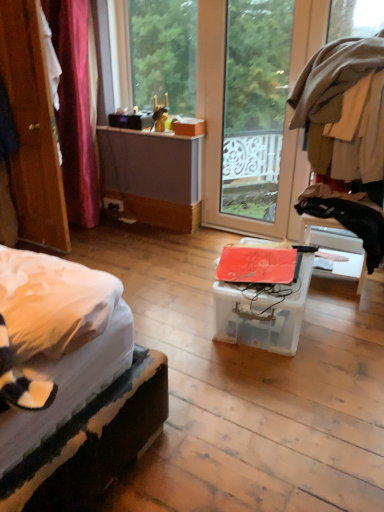
Measure the distance between transparent glass window at upper center and camera.

transparent glass window at upper center is 3.25 meters away from camera.

Describe the element at coordinates (113, 204) in the screenshot. This screenshot has height=512, width=384. I see `black plastic power outlet at lower left` at that location.

Find the location of a particular element. black fabric at right is located at coordinates (350, 213).

The height and width of the screenshot is (512, 384). Identify the location of wooden door at left. (32, 128).

Find the location of a particular element. transparent plastic box at center is located at coordinates (262, 295).

Measure the distance between transparent glass door at center and camera.

The distance of transparent glass door at center from camera is 13.15 feet.

The image size is (384, 512). I want to click on transparent glass window at upper center, so click(157, 53).

From a real-world perspective, is black plastic power outlet at lower left positioned under black fabric at right based on gravity?

Yes, from a real-world perspective, black plastic power outlet at lower left is below black fabric at right.

You are a GUI agent. You are given a task and a screenshot of the screen. Output one action in this format:
    pyautogui.click(x=<x>, y=<y>)
    Task: Click on the clothing lying in front of the black plastic power outlet at lower left
    Image resolution: width=384 pixels, height=512 pixels.
    Given the screenshot: What is the action you would take?
    pyautogui.click(x=350, y=213)

Would you say black plastic power outlet at lower left is outside black fabric at right?

Absolutely, black plastic power outlet at lower left is external to black fabric at right.

From their relative heights in the image, would you say black plastic power outlet at lower left is taller or shorter than black fabric at right?

Considering their sizes, black plastic power outlet at lower left has less height than black fabric at right.

Measure the distance from wooden door at left to transparent glass window at upper center.

They are 1.31 meters apart.

Would you say wooden door at left is inside or outside transparent glass window at upper center?

wooden door at left is outside transparent glass window at upper center.

Between wooden door at left and transparent glass window at upper center, which one appears on the right side from the viewer's perspective?

Positioned to the right is transparent glass window at upper center.

Considering the sizes of objects wooden door at left and transparent glass window at upper center in the image provided, who is smaller, wooden door at left or transparent glass window at upper center?

Smaller between the two is transparent glass window at upper center.

Is black fabric at right touching black plastic power outlet at lower left?

No, black fabric at right is not making contact with black plastic power outlet at lower left.

Would you say black fabric at right is outside black plastic power outlet at lower left?

black fabric at right lies outside black plastic power outlet at lower left's area.

Is black fabric at right oriented towards black plastic power outlet at lower left?

No.

Is black fabric at right smaller than black plastic power outlet at lower left?

Incorrect, black fabric at right is not smaller in size than black plastic power outlet at lower left.

Is transparent glass door at center positioned far away from wooden door at left?

Yes, transparent glass door at center and wooden door at left are quite far apart.

From a real-world perspective, is transparent glass door at center physically located above or below wooden door at left?

transparent glass door at center is situated lower than wooden door at left in the real world.

Is transparent glass door at center looking in the opposite direction of wooden door at left?

No.

Locate an element on the screen. The width and height of the screenshot is (384, 512). glass door on the right of the wooden door at left is located at coordinates (255, 105).

Can you see black plastic power outlet at lower left touching transparent glass window at upper center?

No, black plastic power outlet at lower left is not making contact with transparent glass window at upper center.

Could you tell me if black plastic power outlet at lower left is facing transparent glass window at upper center?

No, black plastic power outlet at lower left is not turned towards transparent glass window at upper center.

Is black plastic power outlet at lower left situated inside transparent glass window at upper center or outside?

black plastic power outlet at lower left is not inside transparent glass window at upper center, it's outside.

Looking at this image, is wooden door at left closer to the viewer compared to transparent plastic box at center?

No, wooden door at left is further to the viewer.

Is transparent plastic box at center completely or partially inside wooden door at left?

That's incorrect, transparent plastic box at center is not inside wooden door at left.

Considering the points (37, 97) and (275, 302), which point is in front, point (37, 97) or point (275, 302)?

Point (275, 302)

In the image, is transparent plastic box at center positioned in front of or behind transparent glass window at upper center?

transparent plastic box at center is positioned closer to the viewer than transparent glass window at upper center.

Identify the location of box on the right of transparent glass window at upper center. (262, 295).

Considering the sizes of transparent plastic box at center and transparent glass window at upper center in the image, is transparent plastic box at center wider or thinner than transparent glass window at upper center?

Clearly, transparent plastic box at center has more width compared to transparent glass window at upper center.

Is transparent plastic box at center inside or outside of transparent glass window at upper center?

transparent plastic box at center is located beyond the bounds of transparent glass window at upper center.

The image size is (384, 512). I want to click on clothing in front of the black plastic power outlet at lower left, so click(x=350, y=213).

The width and height of the screenshot is (384, 512). In order to click on window behind the wooden door at left in this screenshot , I will do `click(157, 53)`.

Looking at the image, which one is located further to transparent plastic box at center, transparent glass window at upper center or transparent glass door at center?

transparent glass door at center is further to transparent plastic box at center.

Based on their spatial positions, is transparent glass door at center or transparent plastic box at center closer to black plastic power outlet at lower left?

Among the two, transparent plastic box at center is located nearer to black plastic power outlet at lower left.

When comparing their distances from transparent plastic box at center, does transparent glass window at upper center or wooden door at left seem closer?

wooden door at left lies closer to transparent plastic box at center than the other object.

Looking at the image, which one is located closer to wooden door at left, black fabric at right or transparent plastic box at center?

transparent plastic box at center lies closer to wooden door at left than the other object.

Which object lies further to the anchor point transparent glass window at upper center, black plastic power outlet at lower left or wooden door at left?

black plastic power outlet at lower left.

Looking at the image, which one is located closer to wooden door at left, black plastic power outlet at lower left or black fabric at right?

The object closer to wooden door at left is black plastic power outlet at lower left.

Looking at the image, which one is located closer to black plastic power outlet at lower left, black fabric at right or transparent glass window at upper center?

transparent glass window at upper center is positioned closer to the anchor black plastic power outlet at lower left.

Which object lies further to the anchor point transparent plastic box at center, black fabric at right or transparent glass door at center?

Among the two, transparent glass door at center is located further to transparent plastic box at center.

I want to click on window located between transparent glass door at center and black plastic power outlet at lower left in the depth direction, so click(x=157, y=53).

The width and height of the screenshot is (384, 512). In order to click on power outlet between wooden door at left and black fabric at right in this screenshot , I will do `click(113, 204)`.

Locate an element on the screen. This screenshot has width=384, height=512. window between transparent plastic box at center and black plastic power outlet at lower left from front to back is located at coordinates (157, 53).

Locate an element on the screen. The image size is (384, 512). glass door between transparent glass window at upper center and black fabric at right vertically is located at coordinates (255, 105).